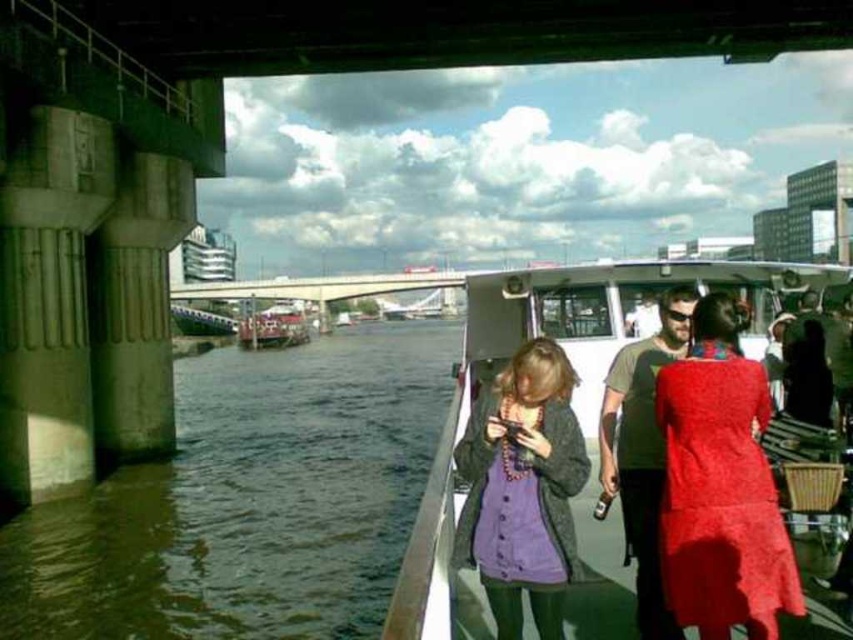
Can you confirm if brown murky water at lower left is positioned above white plastic boat at center?

No, brown murky water at lower left is not above white plastic boat at center.

From the picture: Is brown murky water at lower left behind white plastic boat at center?

Yes, brown murky water at lower left is behind white plastic boat at center.

Does point (250, 451) lie in front of point (669, 276)?

No, (250, 451) is behind (669, 276).

What are the coordinates of `brown murky water at lower left` in the screenshot? It's located at [248, 500].

Which is behind, point (509, 492) or point (296, 339)?

The point (296, 339) is more distant.

Does matte purple dress at center appear over metallic silver boat at center?

No, matte purple dress at center is not above metallic silver boat at center.

Is point (538, 435) farther from camera compared to point (287, 330)?

No, it is not.

Find the location of a particular element. This screenshot has width=853, height=640. matte purple dress at center is located at coordinates (521, 488).

Measure the distance between point (749, 611) and camera.

Point (749, 611) and camera are 16.56 meters apart from each other.

Who is shorter, matte red dress at center or matte purple dress at center?

matte red dress at center

Between point (741, 548) and point (547, 483), which one is positioned behind?

The point (547, 483) is more distant.

Identify the location of matte red dress at center. This screenshot has height=640, width=853. (720, 486).